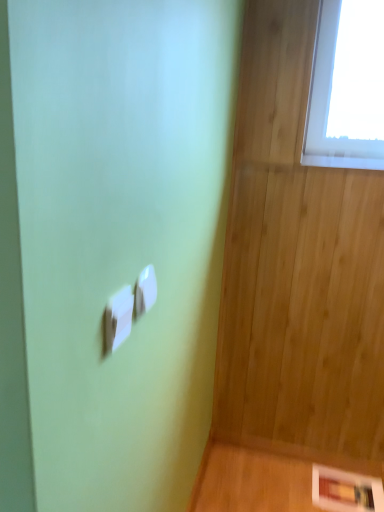
Question: Is white plastic light switch at center, placed as the 1th light switch when sorted from front to back, a part of white glossy picture frame at lower right?

Choices:
 (A) no
 (B) yes

Answer: (A)

Question: Is white glossy picture frame at lower right completely or partially outside of white plastic light switch at center, placed as the 1th light switch when sorted from front to back?

Choices:
 (A) no
 (B) yes

Answer: (B)

Question: Can you confirm if white glossy picture frame at lower right is shorter than white plastic light switch at center, placed as the 1th light switch when sorted from front to back?

Choices:
 (A) yes
 (B) no

Answer: (A)

Question: Is white glossy picture frame at lower right taller than white plastic light switch at center, the second light switch when ordered from right to left?

Choices:
 (A) no
 (B) yes

Answer: (A)

Question: From a real-world perspective, is white glossy picture frame at lower right positioned over white plastic light switch at center, the 1th light switch when ordered from left to right, based on gravity?

Choices:
 (A) yes
 (B) no

Answer: (B)

Question: Looking at their shapes, would you say white plastic light switch at center, which appears as the second light switch when viewed from the left, is wider or thinner than white plastic light switch at center, the second light switch when ordered from right to left?

Choices:
 (A) wide
 (B) thin

Answer: (B)

Question: From their relative heights in the image, would you say white plastic light switch at center, which ranks as the 1th light switch in right-to-left order, is taller or shorter than white plastic light switch at center, the 1th light switch when ordered from left to right?

Choices:
 (A) short
 (B) tall

Answer: (A)

Question: Do you think white plastic light switch at center, which appears as the second light switch when viewed from the left, is within white plastic light switch at center, the 1th light switch when ordered from left to right, or outside of it?

Choices:
 (A) outside
 (B) inside

Answer: (A)

Question: Based on their sizes in the image, would you say white plastic light switch at center, which is counted as the first light switch, starting from the back, is bigger or smaller than white plastic light switch at center, the 1th light switch when ordered from left to right?

Choices:
 (A) big
 (B) small

Answer: (B)

Question: Is point (125, 314) positioned closer to the camera than point (150, 270)?

Choices:
 (A) closer
 (B) farther

Answer: (A)

Question: From a real-world perspective, is white plastic light switch at center, the 1th light switch when ordered from left to right, above or below white plastic light switch at center, which is the 2th light switch from front to back?

Choices:
 (A) below
 (B) above

Answer: (A)

Question: From the image's perspective, relative to white plastic light switch at center, which is counted as the first light switch, starting from the back, is white plastic light switch at center, placed as the 1th light switch when sorted from front to back, above or below?

Choices:
 (A) below
 (B) above

Answer: (A)

Question: Based on their sizes in the image, would you say white plastic light switch at center, the 1th light switch when ordered from left to right, is bigger or smaller than white plastic light switch at center, which ranks as the 1th light switch in right-to-left order?

Choices:
 (A) big
 (B) small

Answer: (A)

Question: From their relative heights in the image, would you say white plastic light switch at center, placed as the 1th light switch when sorted from front to back, is taller or shorter than white glossy picture frame at lower right?

Choices:
 (A) tall
 (B) short

Answer: (A)

Question: From the image's perspective, is white plastic light switch at center, the second light switch when ordered from right to left, above or below white glossy picture frame at lower right?

Choices:
 (A) below
 (B) above

Answer: (B)